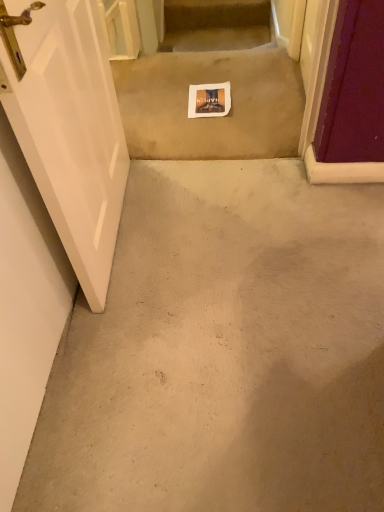
Question: Does white paper at center have a lesser height compared to beige carpet at center?

Choices:
 (A) no
 (B) yes

Answer: (B)

Question: Does white paper at center come in front of beige carpet at center?

Choices:
 (A) no
 (B) yes

Answer: (A)

Question: Is white paper at center thinner than beige carpet at center?

Choices:
 (A) yes
 (B) no

Answer: (A)

Question: Can you confirm if white paper at center is taller than beige carpet at center?

Choices:
 (A) no
 (B) yes

Answer: (A)

Question: Does white paper at center touch beige carpet at center?

Choices:
 (A) no
 (B) yes

Answer: (A)

Question: In the image, is white paper at center on the left side or the right side of white glossy door at left?

Choices:
 (A) right
 (B) left

Answer: (A)

Question: Is white paper at center wider or thinner than white glossy door at left?

Choices:
 (A) thin
 (B) wide

Answer: (B)

Question: Based on their sizes in the image, would you say white paper at center is bigger or smaller than white glossy door at left?

Choices:
 (A) big
 (B) small

Answer: (B)

Question: Considering their positions, is white paper at center located in front of or behind white glossy door at left?

Choices:
 (A) front
 (B) behind

Answer: (B)

Question: Is white paper at center spatially inside carpeted stairs at upper center, or outside of it?

Choices:
 (A) outside
 (B) inside

Answer: (A)

Question: Considering the positions of point (188, 106) and point (241, 17), is point (188, 106) closer or farther from the camera than point (241, 17)?

Choices:
 (A) farther
 (B) closer

Answer: (B)

Question: Is white paper at center wider or thinner than carpeted stairs at upper center?

Choices:
 (A) wide
 (B) thin

Answer: (A)

Question: From a real-world perspective, is white paper at center above or below carpeted stairs at upper center?

Choices:
 (A) above
 (B) below

Answer: (A)

Question: From the image's perspective, is carpeted stairs at upper center positioned above or below white glossy door at left?

Choices:
 (A) above
 (B) below

Answer: (A)

Question: Is carpeted stairs at upper center in front of or behind white glossy door at left in the image?

Choices:
 (A) front
 (B) behind

Answer: (B)